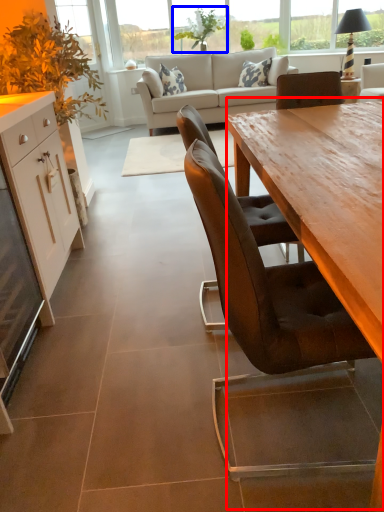
Question: Among these objects, which one is farthest to the camera, table (highlighted by a red box) or plant (highlighted by a blue box)?

Choices:
 (A) table
 (B) plant

Answer: (B)